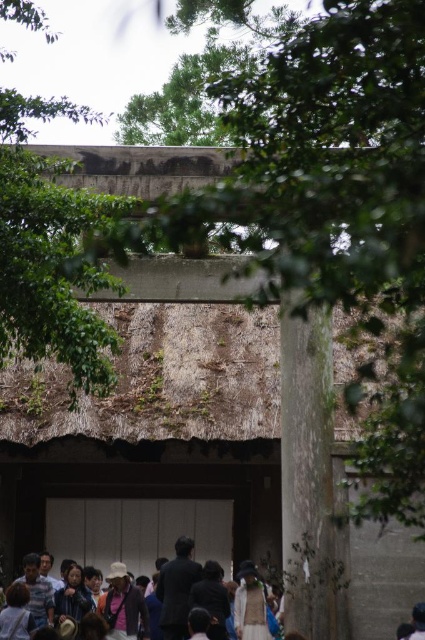
Question: Does green leafy tree at upper center have a greater width compared to light brown fabric jacket at lower center?

Choices:
 (A) no
 (B) yes

Answer: (B)

Question: Considering the real-world distances, which object is closest to the smooth gray stone pillar at right?

Choices:
 (A) green leafy tree at upper center
 (B) light brown fabric jacket at lower center

Answer: (B)

Question: In this image, where is smooth gray stone pillar at right located relative to light brown fabric jacket at lower center?

Choices:
 (A) above
 (B) below

Answer: (A)

Question: Which object is farther from the camera taking this photo?

Choices:
 (A) green leafy tree at upper center
 (B) light brown fabric jacket at lower center
 (C) smooth gray stone pillar at right

Answer: (B)

Question: Among these points, which one is farthest from the camera?

Choices:
 (A) (297, 364)
 (B) (178, 582)
 (C) (19, 280)

Answer: (B)

Question: Is green leafy tree at upper center wider than light brown fabric jacket at lower center?

Choices:
 (A) yes
 (B) no

Answer: (A)